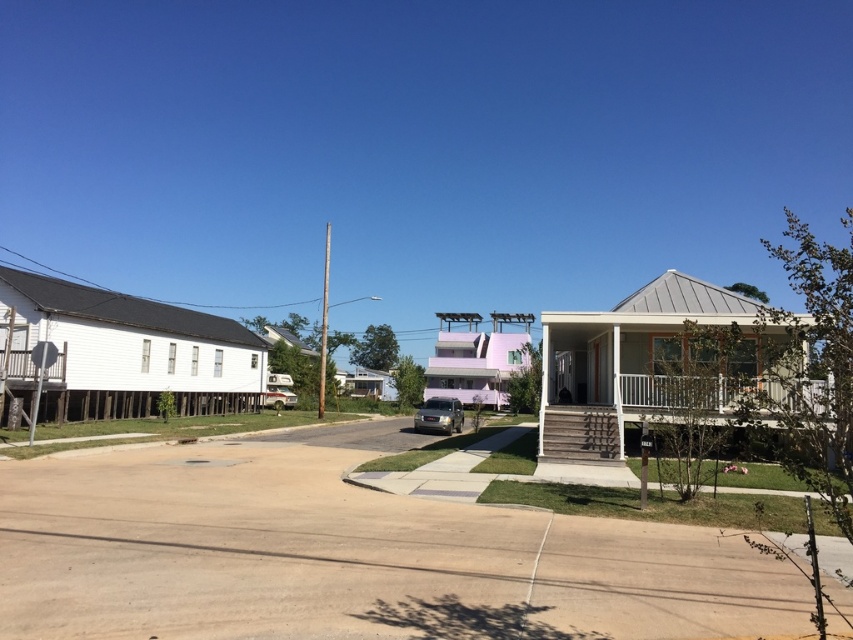
Question: Can you confirm if smooth concrete driveway at center is positioned above satin gold suv at center?

Choices:
 (A) no
 (B) yes

Answer: (B)

Question: Which point is farther to the camera?

Choices:
 (A) (419, 406)
 (B) (274, 397)
 (C) (741, 582)

Answer: (A)

Question: In this image, where is satin gold suv at center located relative to metallic silver car at center?

Choices:
 (A) above
 (B) below

Answer: (B)

Question: Can you confirm if satin gold suv at center is bigger than metallic silver car at center?

Choices:
 (A) yes
 (B) no

Answer: (A)

Question: Estimate the real-world distances between objects in this image. Which object is farther from the smooth concrete driveway at center?

Choices:
 (A) satin gold suv at center
 (B) metallic silver car at center

Answer: (B)

Question: Which point is farther to the camera?

Choices:
 (A) metallic silver car at center
 (B) satin gold suv at center

Answer: (A)